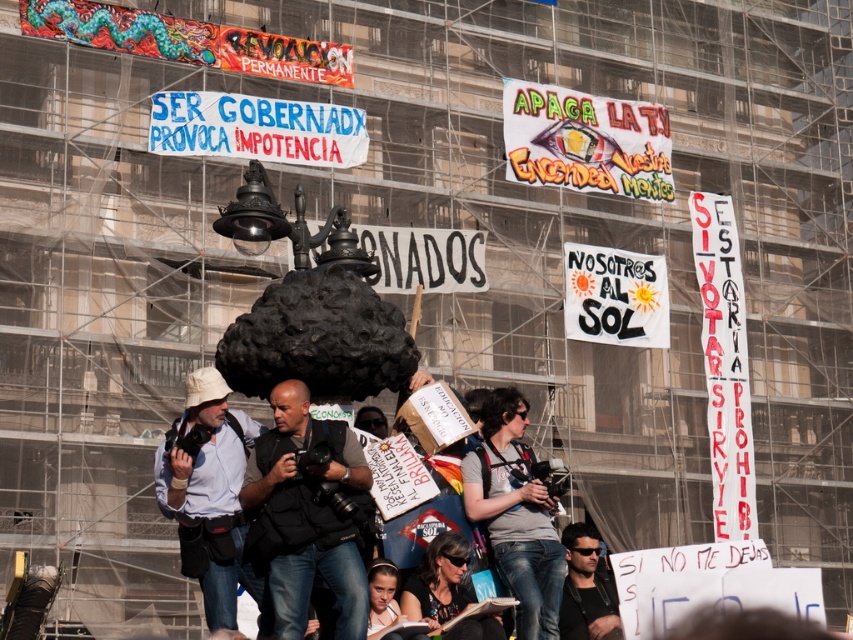
You are a photographer standing at the protest scene. You want to take a closeup photo of the dark gray vest at center but your camera has a maximum focus range of 30 meters. Can you capture the vest clearly?

The dark gray vest at center is 35.31 meters away from the camera. Since the maximum focus range is 30 meters, the camera cannot focus on the dark gray vest at center clearly.

You are a photographer trying to capture a clear shot of the protest scene. You notice a person at the center wearing a dark gray vest and have dark hair. Which part of the person, the dark gray vest at center or the dark hair at center, would appear wider in your photo?

The dark gray vest at center is wider than the dark hair at center, so the dark gray vest at center would appear wider in the photo.

You are a photographer trying to capture a closeup of the protest banners. You notice a person wearing a white matte shirt at lower left and someone with dark hair at center in your shot. To avoid them blocking the banners, which part of the person should you adjust your camera angle to focus on the banners more clearly?

To avoid the white matte shirt at lower left and dark hair at center blocking the banners, adjust the camera angle to focus higher, as the banners are prominently displayed across the scaffolding above them.